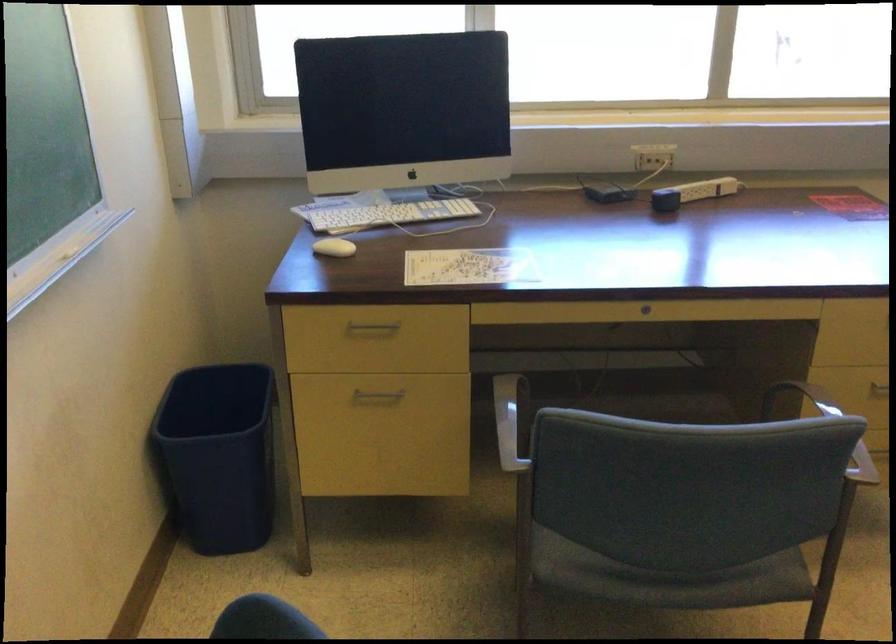
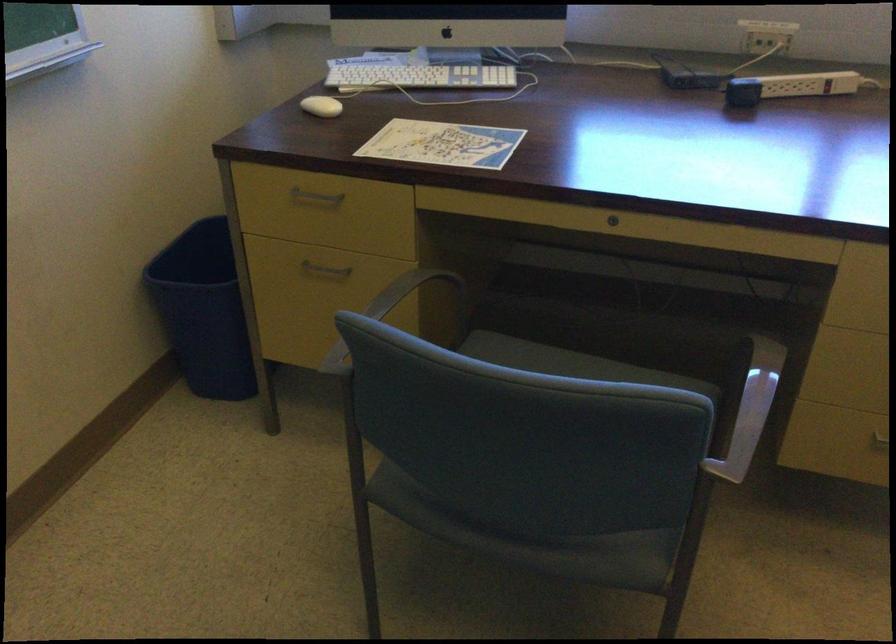
Find the pixel in the second image that matches pixel 337 245 in the first image.

(321, 106)